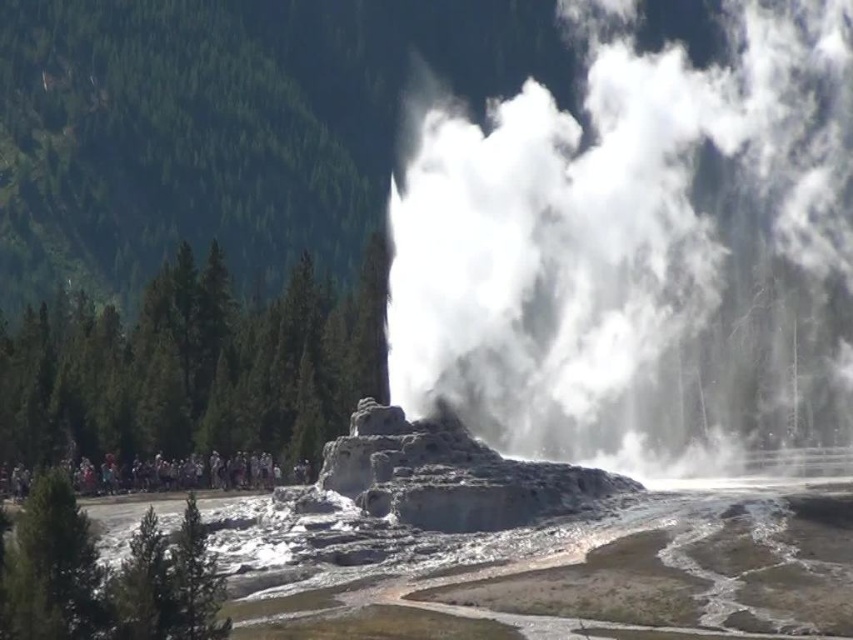
You are a photographer standing at the edge of the geothermal area. You want to capture a photo of the white vapor at center and the multicolored clothing at lower left in the same frame. Based on their positions, can you tell which object is closer to you?

The multicolored clothing at lower left is closer to you because the white vapor at center is above it, indicating it is further away.

Consider the image. You are a park ranger trying to ensure visitor safety. You notice the white vapor at center and the multicolored clothing at lower left. Based on their positions, which object is closer to you?

The white vapor at center is closer to you because it is in front of the multicolored clothing at lower left.

You are standing at the point closest to the geyser in the image. There are two points marked in the scene, one at coordinates point (697, 305) and the other at point (79, 461). If you want to move towards the geyser, which point should you move towards?

You should move towards point (79, 461) because it is closer to the geyser than point (697, 305), which is further away.